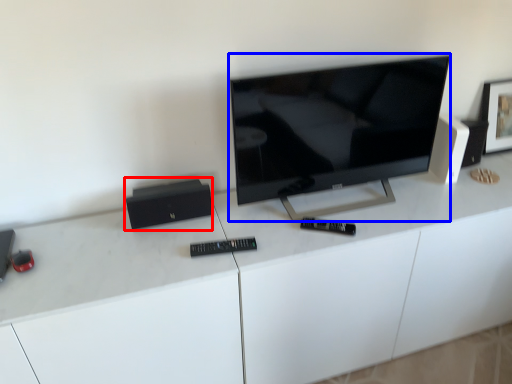
Question: Which point is further to the camera, speaker (highlighted by a red box) or television (highlighted by a blue box)?

Choices:
 (A) speaker
 (B) television

Answer: (A)